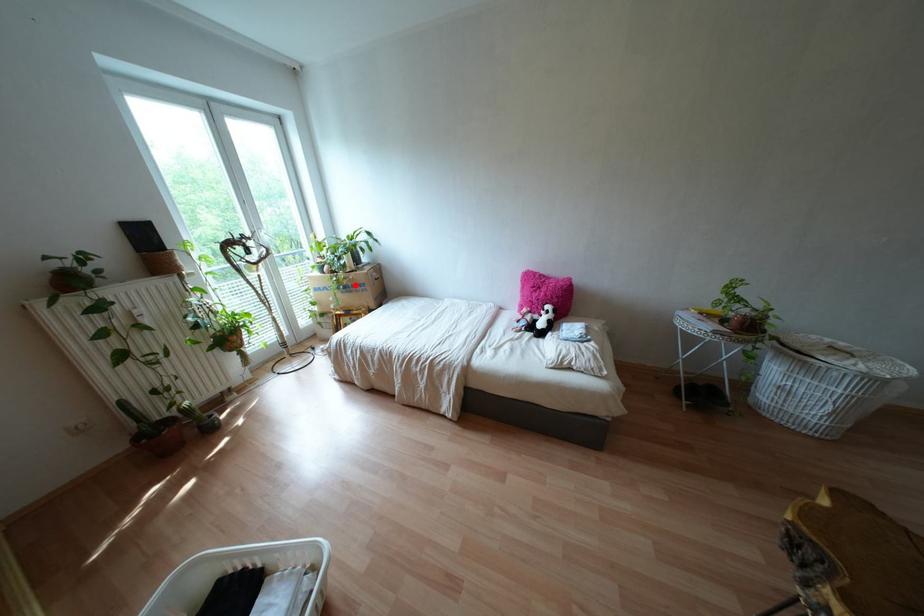
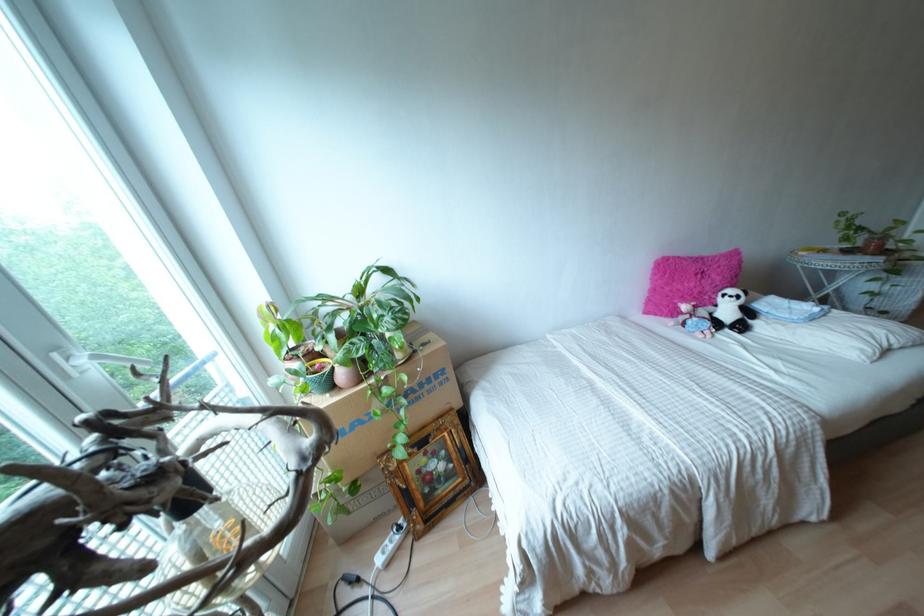
Question: I am providing you with two images of the same scene from different viewpoints. Given a red point in image1, look at the same physical point in image2. Is it:

Choices:
 (A) Closer to the viewpoint
 (B) Farther from the viewpoint

Answer: (B)